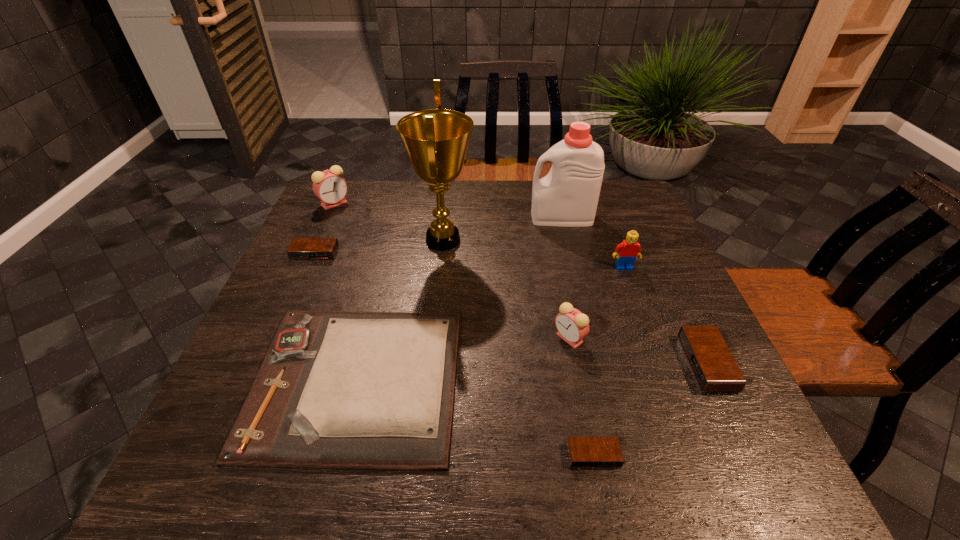
This screenshot has height=540, width=960. Find the location of `vacant position in the image that satisfies the following two spatial constraints: 1. on the front view with handles of the tallest object; 2. on the front face of the farthest black alarm clock`. vacant position in the image that satisfies the following two spatial constraints: 1. on the front view with handles of the tallest object; 2. on the front face of the farthest black alarm clock is located at coordinates (442, 253).

At what (x,y) coordinates should I click in order to perform the action: click on vacant space that satisfies the following two spatial constraints: 1. on the front face of the rightmost black alarm clock; 2. on the front face of the smallest black alarm clock. Please return your answer as a coordinate pair (x, y). This screenshot has width=960, height=540. Looking at the image, I should click on (750, 455).

Locate an element on the screen. blank space that satisfies the following two spatial constraints: 1. on the front view with handles of the gold award; 2. on the front face of the seventh tallest object is located at coordinates (442, 253).